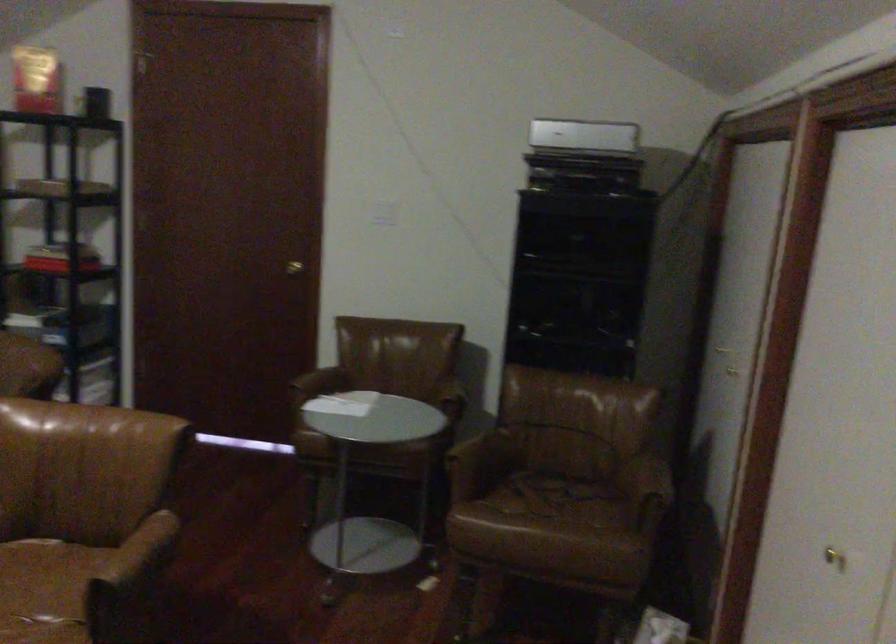
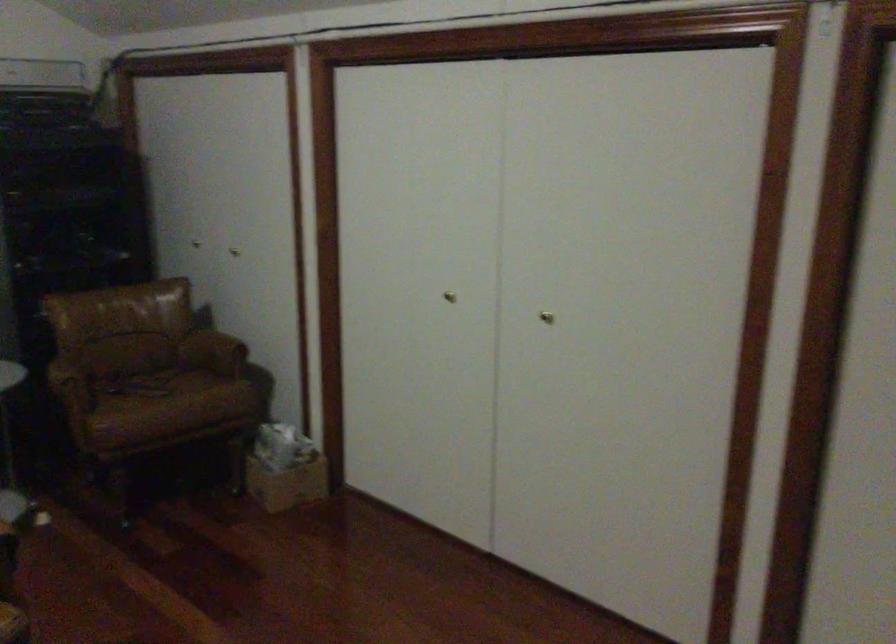
Find the pixel in the second image that matches pixel 578 486 in the first image.

(149, 370)